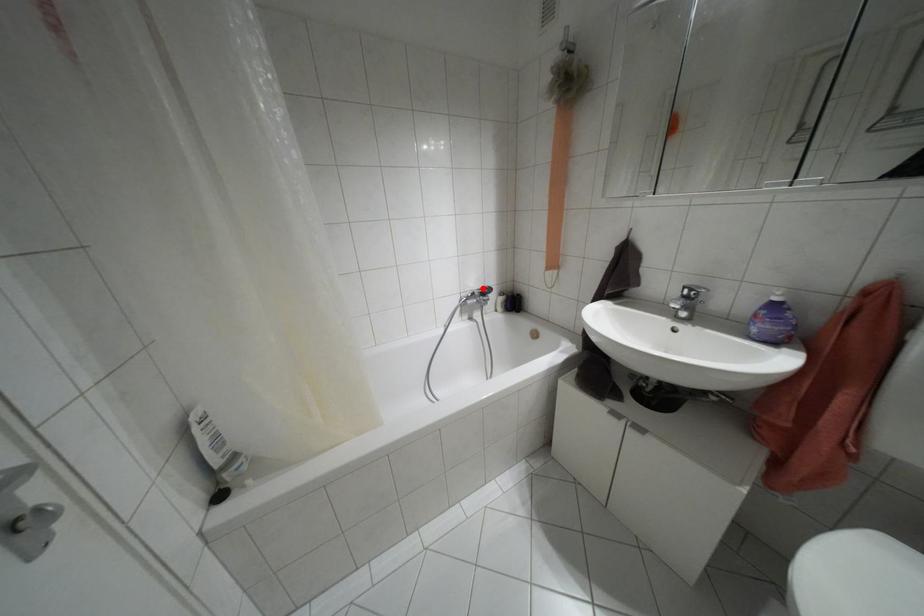
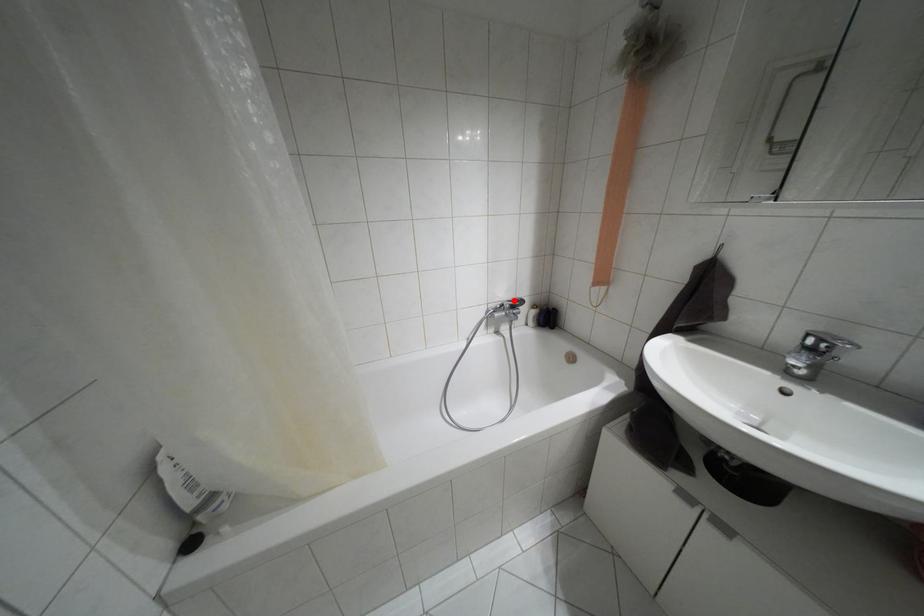
I am providing you with two images of the same scene from different viewpoints. A red point is marked on the first image and another point is marked on the second image. Do the highlighted points in image1 and image2 indicate the same real-world spot?

Yes